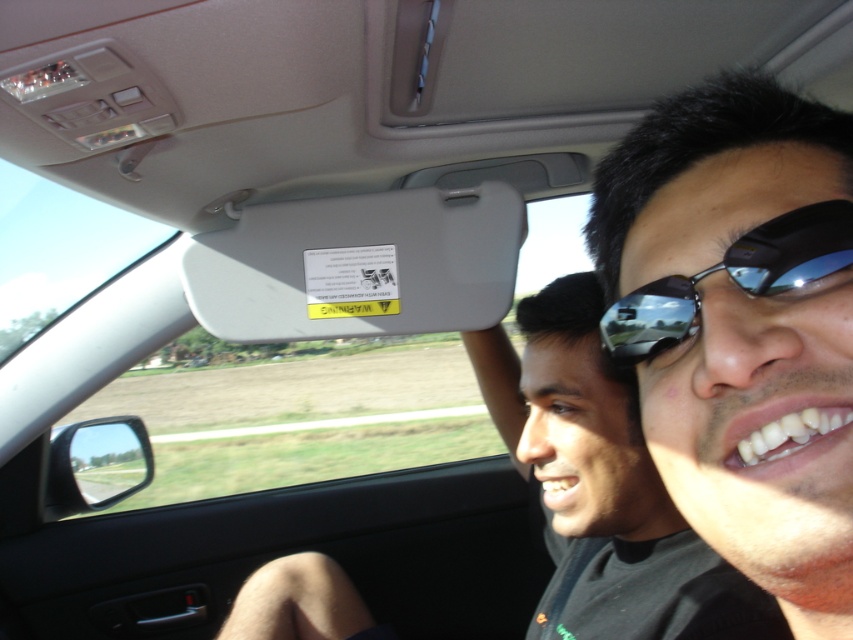
Question: Is sunglasses at center wider than matte black sunglasses at upper right?

Choices:
 (A) yes
 (B) no

Answer: (B)

Question: Which of these objects is positioned farthest from the matte black sunglasses at upper right?

Choices:
 (A) shiny black sunglasses at center
 (B) sunglasses at center

Answer: (A)

Question: Does matte black sunglasses at upper right appear on the right side of shiny black sunglasses at center?

Choices:
 (A) no
 (B) yes

Answer: (B)

Question: Can you confirm if matte black sunglasses at upper right is positioned to the left of shiny black sunglasses at center?

Choices:
 (A) yes
 (B) no

Answer: (B)

Question: Estimate the real-world distances between objects in this image. Which object is closer to the matte black sunglasses at upper right?

Choices:
 (A) shiny black sunglasses at center
 (B) sunglasses at center

Answer: (B)

Question: Which object is the closest to the shiny black sunglasses at center?

Choices:
 (A) sunglasses at center
 (B) matte black sunglasses at upper right

Answer: (A)